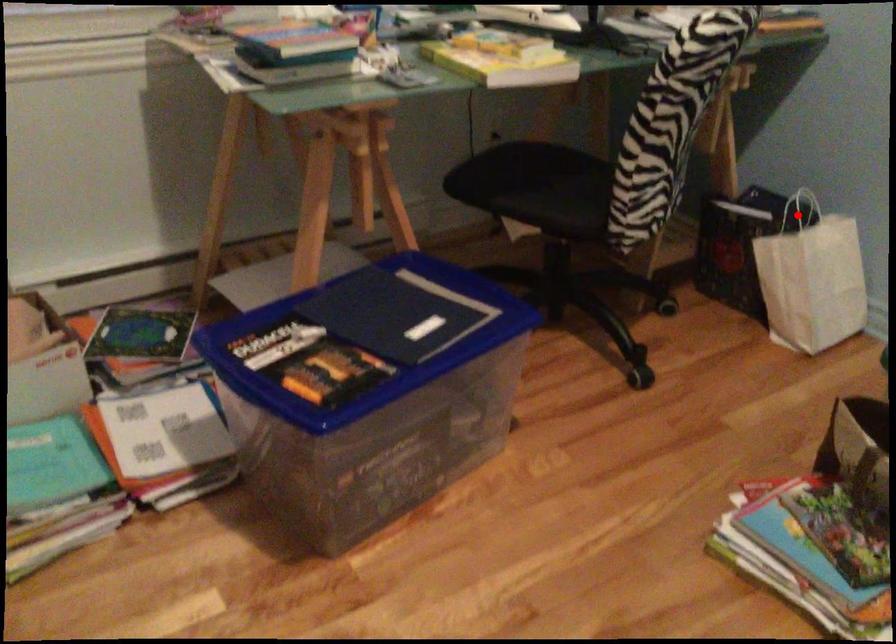
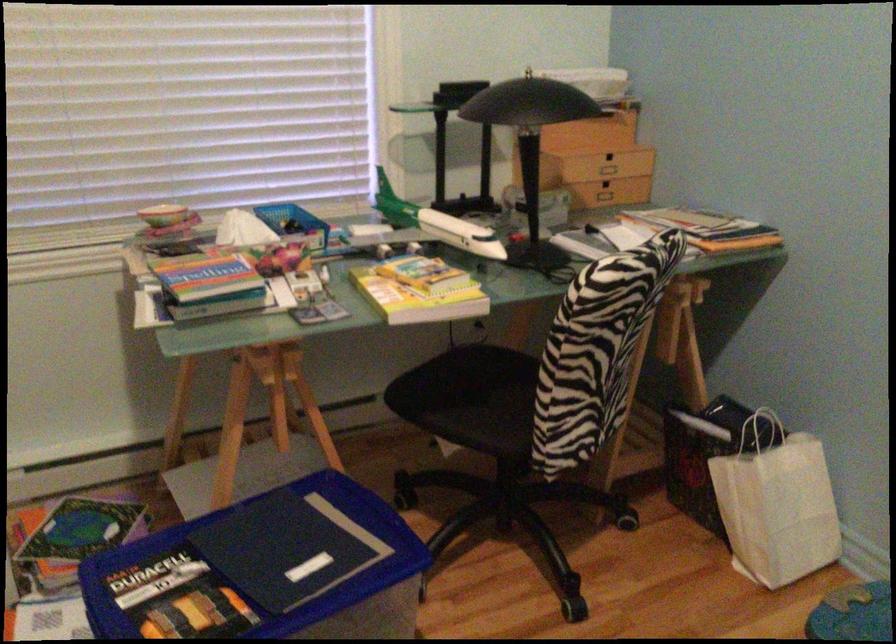
In the second image, find the point that corresponds to the highlighted location in the first image.

(761, 431)